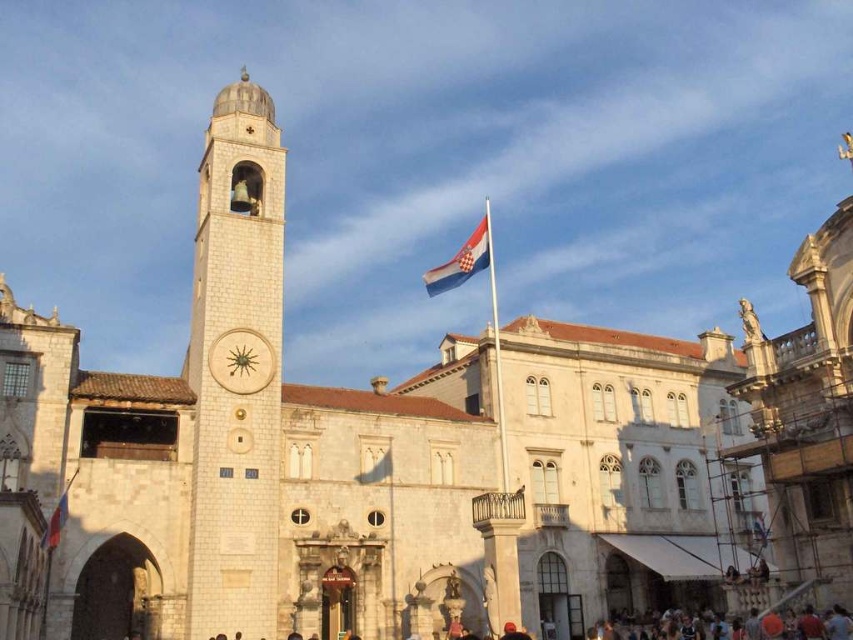
You are a tourist standing in front of the historic building complex. You notice the white stone clock tower at center and the blue and white striped flag at center. Which object is positioned higher in the image?

The white stone clock tower at center is located above the blue and white striped flag at center, so it is positioned higher in the image.

You are a photographer planning to capture the historic building complex. You want to ensure both the white stone clock tower at center and the blue and white striped flag at center are clearly visible in your shot. Given that your camera has a fixed focal length, which object should you prioritize framing closer to the center of the image to accommodate their sizes?

The white stone clock tower at center is wider than the blue and white striped flag at center. To ensure both are visible, prioritize framing the white stone clock tower at center closer to the center of the image since it is larger and requires more space.

You are an architect examining the historic building complex. You notice the wooden clock at center and the red fabric flag at lower left. Which object has a greater width?

The wooden clock at center has a greater width than the red fabric flag at lower left according to the description.